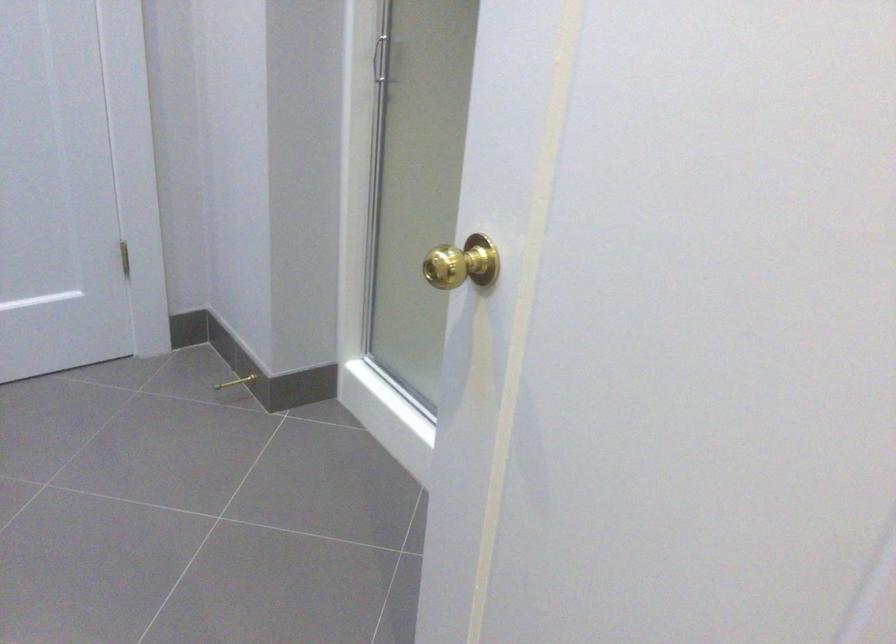
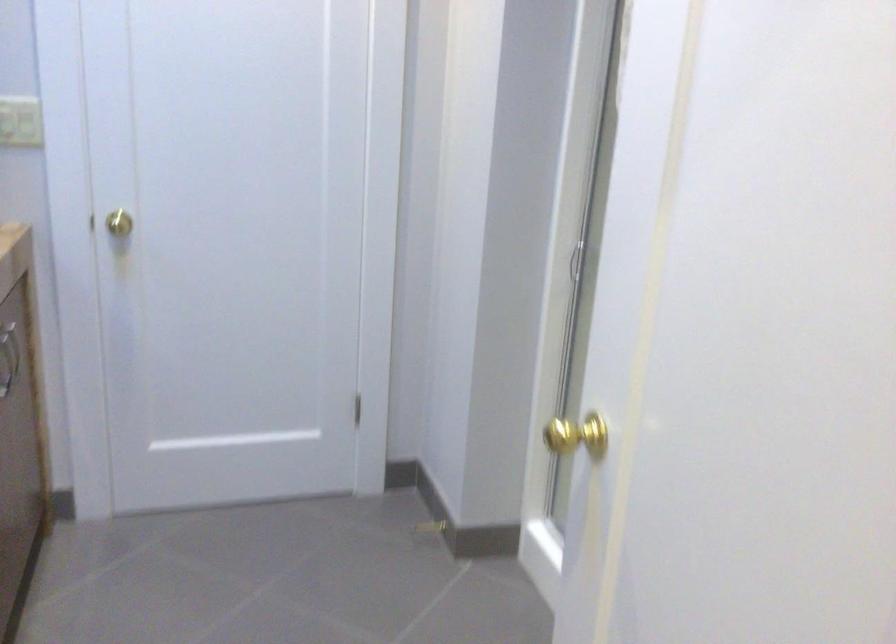
Which direction would the cameraman need to move to produce the second image?

The movement direction of the cameraman is right, backward.